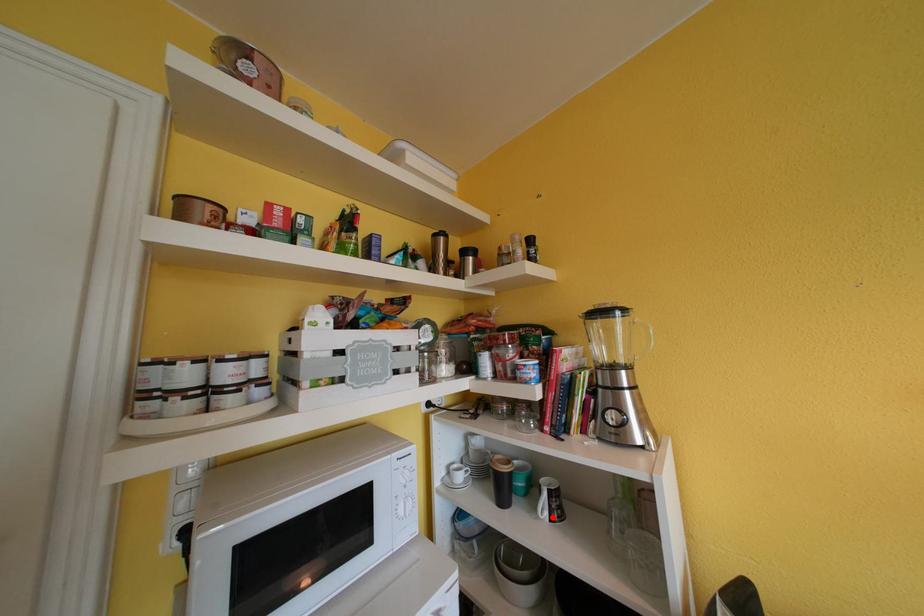
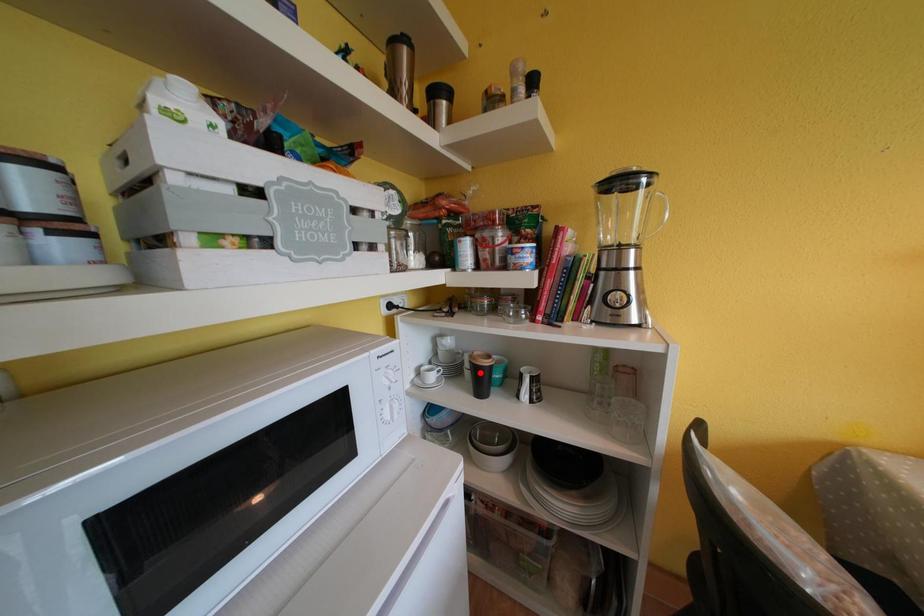
I am providing you with two images of the same scene from different viewpoints. A red point is marked on the first image and another point is marked on the second image. Is the red point in image1 aligned with the point shown in image2?

No